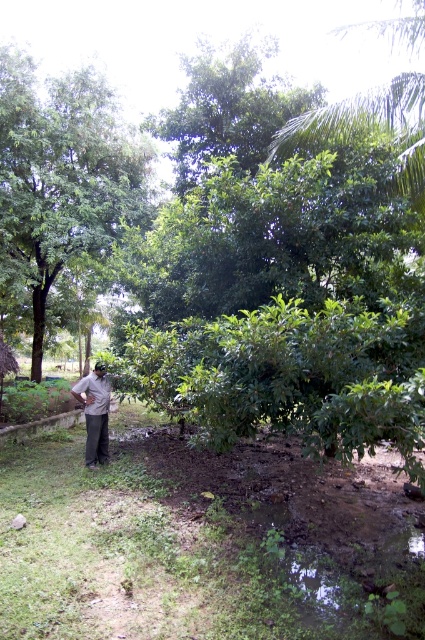
Is green leafy tree at left above dark brown fabric at lower left?

Correct, green leafy tree at left is located above dark brown fabric at lower left.

Between green leafy tree at left and dark brown fabric at lower left, which one appears on the right side from the viewer's perspective?

dark brown fabric at lower left is more to the right.

Find the location of a particular element. This screenshot has width=425, height=640. green leafy tree at left is located at coordinates (61, 179).